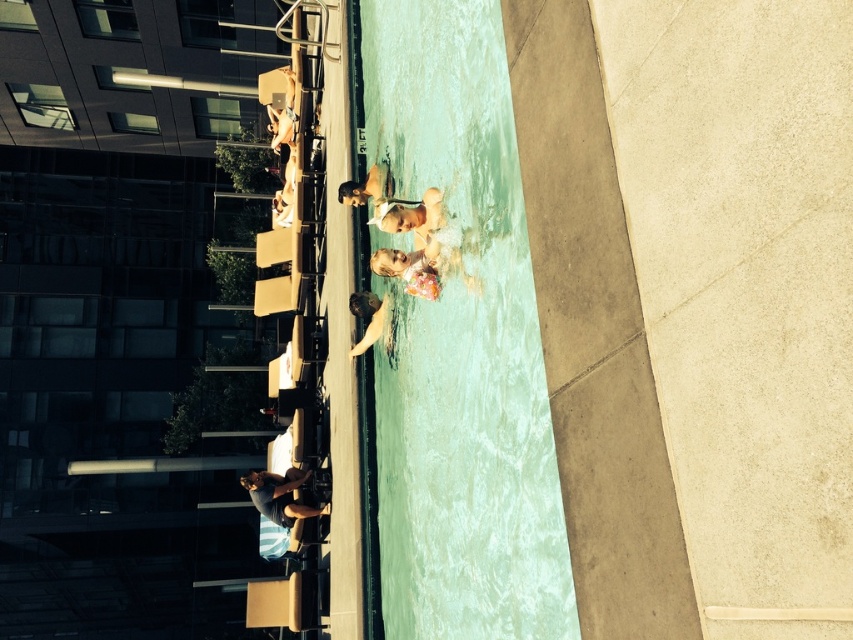
Who is more forward, [416,116] or [392,208]?

Point [392,208] is in front.

This screenshot has width=853, height=640. I want to click on clear water at center, so click(462, 348).

Which of these two, clear water at center or smooth tan skin at center, stands shorter?

Standing shorter between the two is smooth tan skin at center.

Is point (537, 454) more distant than point (381, 332)?

No, (537, 454) is closer to viewer.

Identify the location of clear water at center. This screenshot has height=640, width=853. (462, 348).

Is clear water at center to the right of light brown wooden chair at upper center from the viewer's perspective?

Indeed, clear water at center is positioned on the right side of light brown wooden chair at upper center.

Who is lower down, clear water at center or light brown wooden chair at upper center?

Positioned lower is clear water at center.

Is point (466, 179) positioned before point (294, 86)?

Yes, point (466, 179) is in front of point (294, 86).

You are a GUI agent. You are given a task and a screenshot of the screen. Output one action in this format:
    pyautogui.click(x=<x>, y=<y>)
    Task: Click on the clear water at center
    The image size is (853, 640).
    Given the screenshot: What is the action you would take?
    pyautogui.click(x=462, y=348)